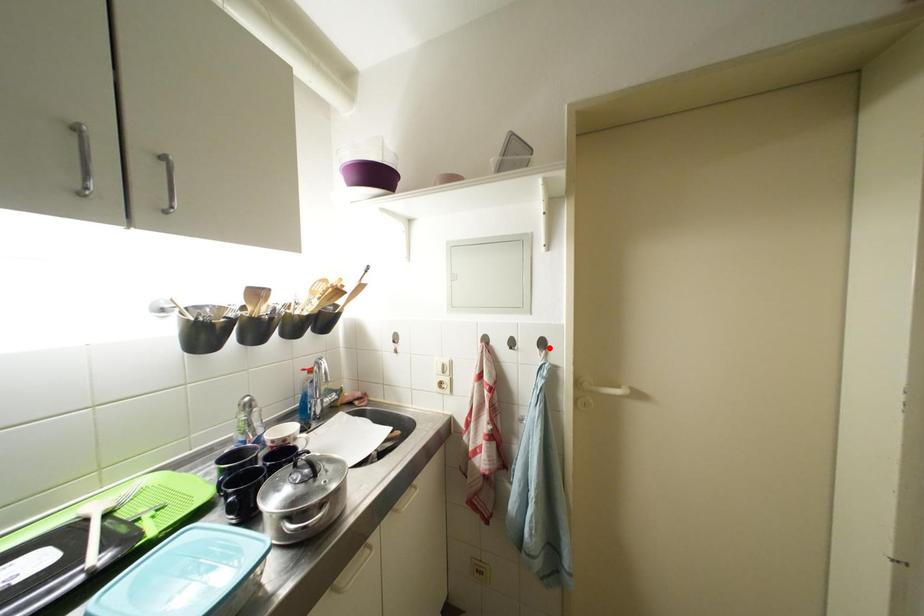
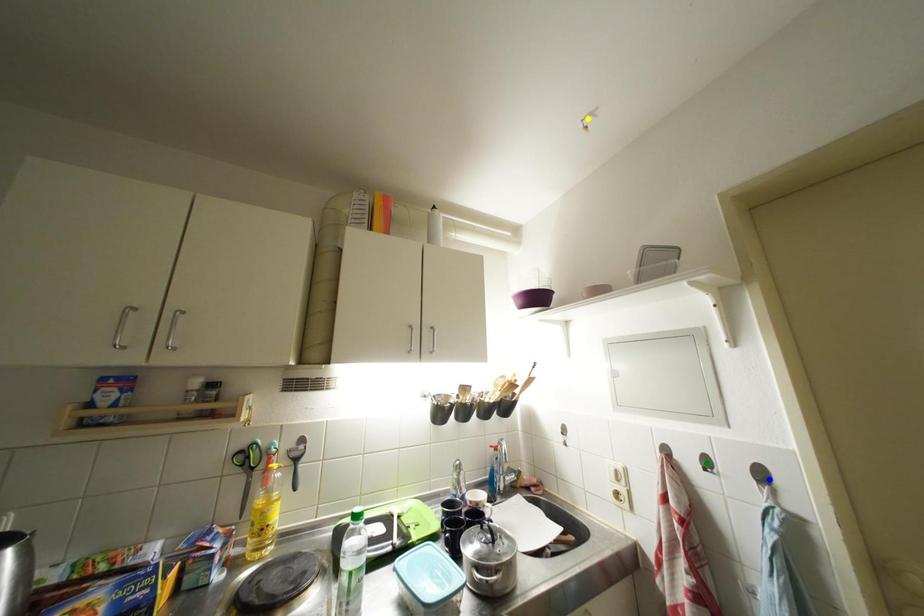
Question: I am providing you with two images of the same scene from different viewpoints. A red point is marked on the first image. You are given multiple points on the second image. Which spot in image 2 lines up with the point in image 1?

Choices:
 (A) blue point
 (B) green point
 (C) yellow point

Answer: (A)